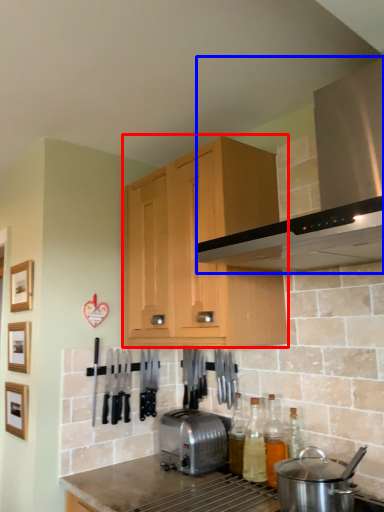
Question: Which object appears closest to the camera in this image, cabinetry (highlighted by a red box) or home appliance (highlighted by a blue box)?

Choices:
 (A) cabinetry
 (B) home appliance

Answer: (B)